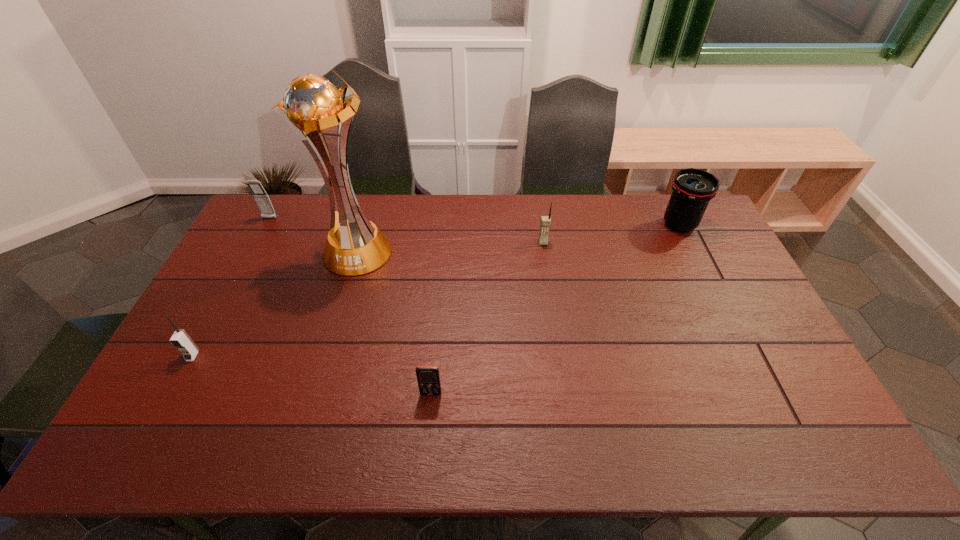
Where is `vacant point located between the tallest object and the nearest object`? This screenshot has width=960, height=540. vacant point located between the tallest object and the nearest object is located at coordinates (394, 322).

You are a GUI agent. You are given a task and a screenshot of the screen. Output one action in this format:
    pyautogui.click(x=<x>, y=<y>)
    Task: Click on the blank region between the telephoto lens and the farthest cellular telephone
    Image resolution: width=960 pixels, height=540 pixels.
    Given the screenshot: What is the action you would take?
    pyautogui.click(x=474, y=222)

Locate an element on the screen. Image resolution: width=960 pixels, height=540 pixels. empty location between the nearest object and the third nearest cellular telephone is located at coordinates (487, 318).

At what (x,y) coordinates should I click in order to perform the action: click on vacant area that lies between the farthest cellular telephone and the third farthest cellular telephone. Please return your answer as a coordinate pair (x, y). Looking at the image, I should click on (231, 287).

Find the location of a particular element. The image size is (960, 540). unoccupied position between the rightmost cellular telephone and the nearest cellular telephone is located at coordinates (487, 318).

Find the location of `vacant space that's between the second nearest object and the trophy`. vacant space that's between the second nearest object and the trophy is located at coordinates (275, 303).

The height and width of the screenshot is (540, 960). I want to click on free space between the farthest cellular telephone and the fifth farthest object, so click(231, 287).

Find the location of a particular element. This screenshot has width=960, height=540. vacant region between the farthest cellular telephone and the tallest object is located at coordinates (313, 235).

In order to click on the third closest object to the rightmost cellular telephone in this screenshot , I will do `click(428, 377)`.

This screenshot has height=540, width=960. In order to click on the second closest object to the third farthest cellular telephone in this screenshot , I will do `click(262, 199)`.